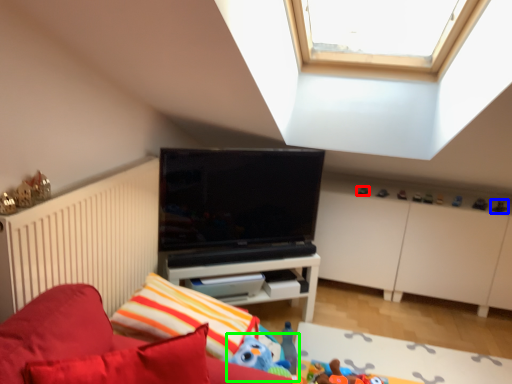
Question: Which object is the farthest from toy (highlighted by a red box)? Choose among these: toy (highlighted by a blue box) or toy (highlighted by a green box).

Choices:
 (A) toy
 (B) toy

Answer: (B)